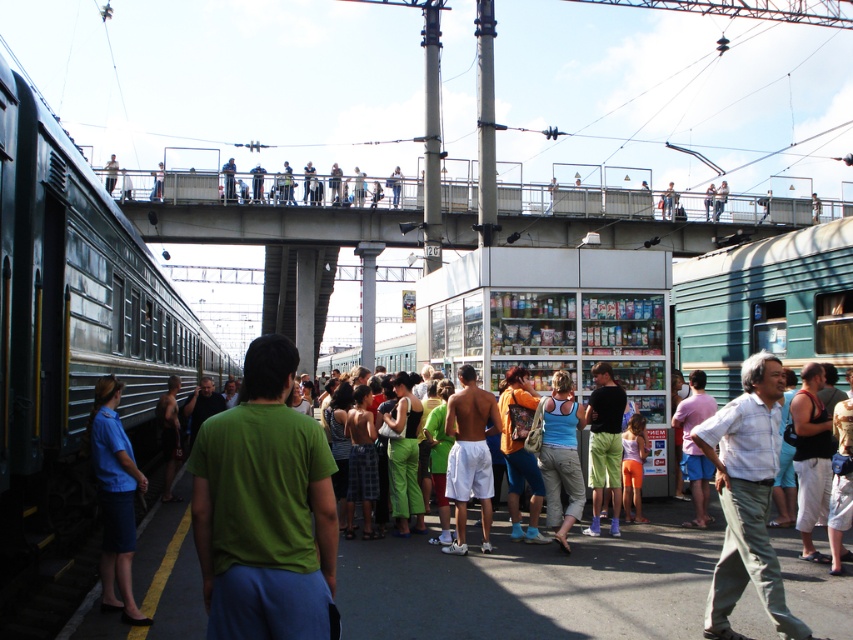
Question: Can you confirm if green matte train at left is thinner than blue fabric shirt at left?

Choices:
 (A) no
 (B) yes

Answer: (A)

Question: Does green matte train at left appear on the left side of blue fabric shirt at left?

Choices:
 (A) no
 (B) yes

Answer: (B)

Question: Which point appears farthest from the camera in this image?

Choices:
 (A) (494, 536)
 (B) (113, 509)

Answer: (A)

Question: Can you confirm if green matte train at left is positioned to the left of blue fabric shirt at left?

Choices:
 (A) yes
 (B) no

Answer: (A)

Question: Which of these objects is positioned farthest from the blue fabric shirt at left?

Choices:
 (A) green cotton shirt at center
 (B) green matte train at left

Answer: (B)

Question: Among these points, which one is farthest from the camera?

Choices:
 (A) (125, 316)
 (B) (404, 573)
 (C) (112, 566)

Answer: (A)